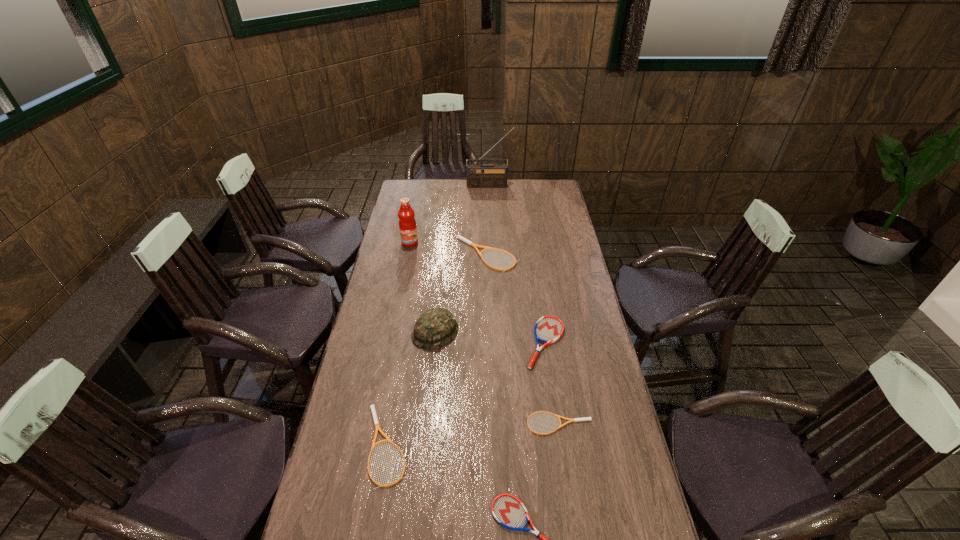
Identify the location of vacant area that lies between the sixth shortest object and the farthest object. (462, 259).

Select which object appears as the second closest to the smallest beige tennis racket. Please provide its 2D coordinates. Your answer should be formatted as a tuple, i.e. [(x, y)], where the tuple contains the x and y coordinates of a point satisfying the conditions above.

[(508, 511)]

Locate which object ranks fifth in proximity to the nearest object. Please provide its 2D coordinates. Your answer should be formatted as a tuple, i.e. [(x, y)], where the tuple contains the x and y coordinates of a point satisfying the conditions above.

[(463, 239)]

Choose which tennis racket is the fourth nearest neighbor to the smallest beige tennis racket. Please provide its 2D coordinates. Your answer should be formatted as a tuple, i.e. [(x, y)], where the tuple contains the x and y coordinates of a point satisfying the conditions above.

[(463, 239)]

Point out which tennis racket is positioned as the fourth nearest to the second tallest object. Please provide its 2D coordinates. Your answer should be formatted as a tuple, i.e. [(x, y)], where the tuple contains the x and y coordinates of a point satisfying the conditions above.

[(558, 416)]

Identify which beige tennis racket is located as the nearest to the leftmost tennis racket. Please provide its 2D coordinates. Your answer should be formatted as a tuple, i.e. [(x, y)], where the tuple contains the x and y coordinates of a point satisfying the conditions above.

[(558, 416)]

Identify which beige tennis racket is the nearest to the farthest object. Please provide its 2D coordinates. Your answer should be formatted as a tuple, i.e. [(x, y)], where the tuple contains the x and y coordinates of a point satisfying the conditions above.

[(463, 239)]

Identify the location of vacant space that satisfies the following two spatial constraints: 1. on the back side of the headwear; 2. on the left side of the leftmost tennis racket. (406, 333).

This screenshot has height=540, width=960. Find the location of `vacant area in the image that satisfies the following two spatial constraints: 1. on the front label of the seventh shortest object; 2. on the right side of the smallest beige tennis racket`. vacant area in the image that satisfies the following two spatial constraints: 1. on the front label of the seventh shortest object; 2. on the right side of the smallest beige tennis racket is located at coordinates (373, 423).

Locate an element on the screen. The height and width of the screenshot is (540, 960). vacant region that satisfies the following two spatial constraints: 1. on the front label of the biggest beige tennis racket; 2. on the left side of the fruit juice is located at coordinates (407, 255).